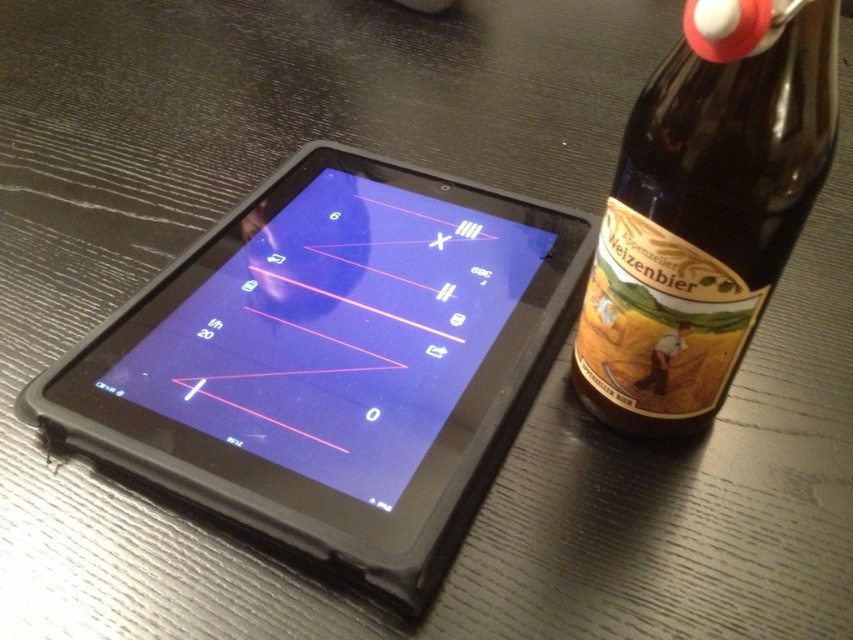
You are trying to place a small key between the black rubberized tablet at center and the brown glass bottle at right. Which object should you move to make space?

The black rubberized tablet at center is bigger than the brown glass bottle at right, so you should move the brown glass bottle at right to create more space for the key.

You are trying to place a 15 inch ruler between the black rubberized tablet at center and the brown glass bottle at right. Will the ruler fit between them?

The distance between the black rubberized tablet at center and the brown glass bottle at right is 14.75 inches, so the ruler will not fit between them as it is slightly shorter than the required space.